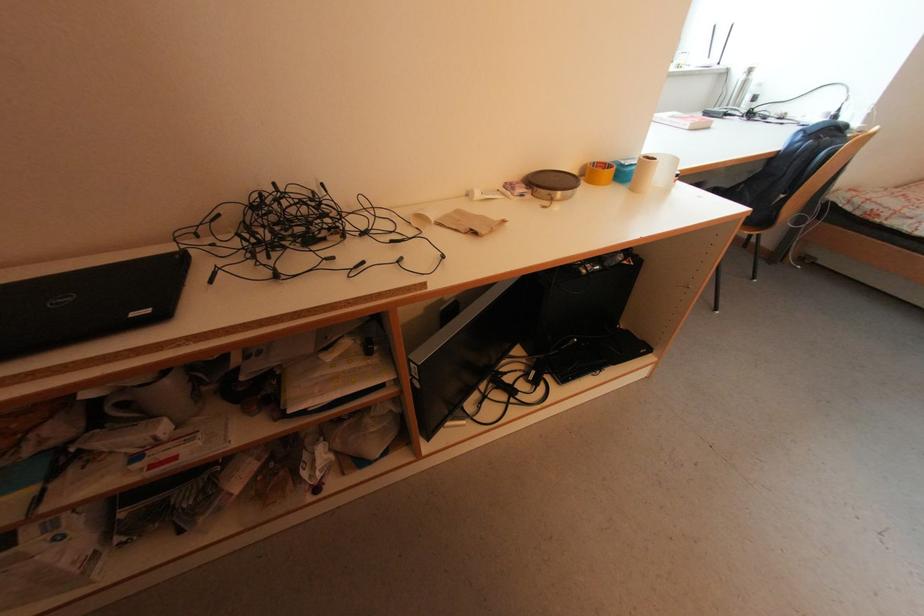
Which object does [599,172] point to?

It corresponds to the yellow tape roll in the image.